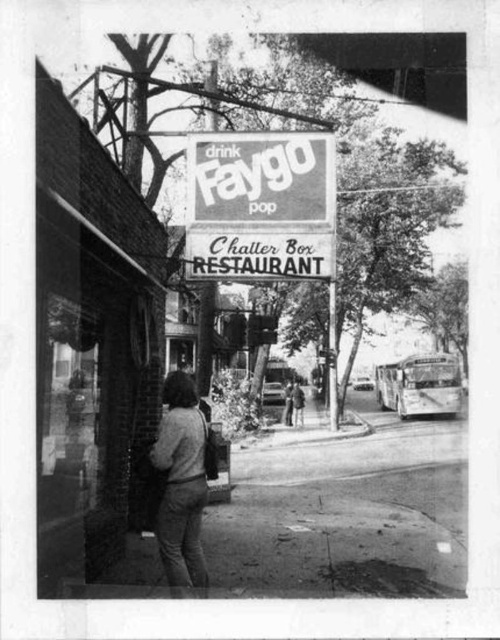
You are a delivery person trying to find the Chatter Box RESTAURANT. You see a white paper sign at center. Where is the sign located in relation to the street?

The white paper sign at center is located at point (261, 205), which is positioned above the sidewalk near the entrance of the building, indicating the restaurant is directly below it.

You are trying to decide which clothing item to wear for a casual day out. You have a matte gray sweater at center and a smooth leather jacket at center in your closet. Based on their sizes, which one might be more suitable for layering under a coat?

The matte gray sweater at center has a smaller size compared to the smooth leather jacket at center, so the smaller size of the matte gray sweater at center makes it more suitable for layering under a coat without bulkiness.

You are a window cleaner standing on the sidewalk looking up at the brick wall at left and the white paper sign at center. Which object is taller?

The brick wall at left is much taller than the white paper sign at center.